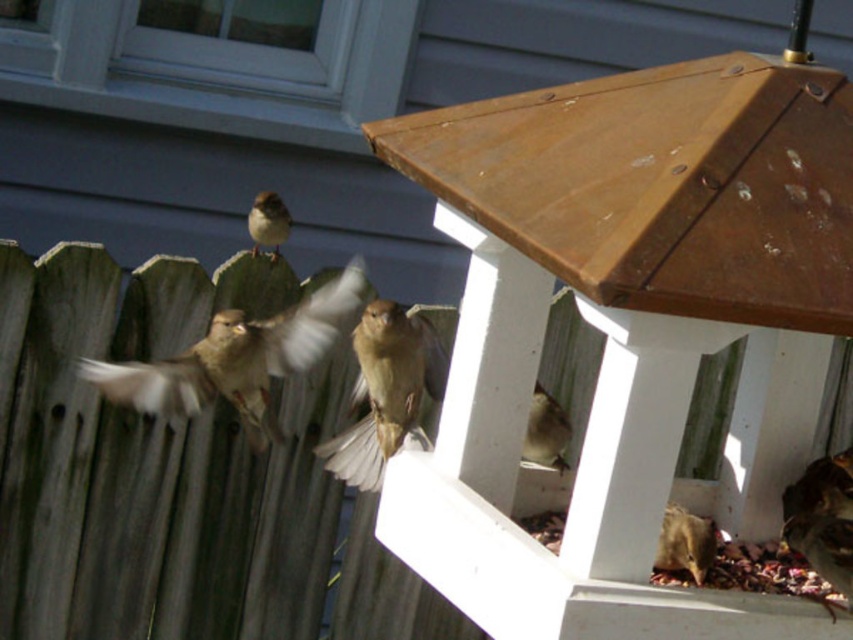
Does weathered wood fence at left appear on the right side of brown matte bird at lower center?

In fact, weathered wood fence at left is to the left of brown matte bird at lower center.

Is point (181, 304) positioned behind point (564, 440)?

Yes, point (181, 304) is farther from viewer.

Identify the location of weathered wood fence at left. This screenshot has width=853, height=640. (152, 464).

Between brown feathered bird at center and brown matte bird at center, which one has more height?

brown feathered bird at center is taller.

Does brown feathered bird at center have a greater height compared to brown matte bird at center?

Yes, brown feathered bird at center is taller than brown matte bird at center.

Where is `brown feathered bird at center`? brown feathered bird at center is located at coordinates (236, 358).

The height and width of the screenshot is (640, 853). What are the coordinates of `brown feathered bird at center` in the screenshot? It's located at (236, 358).

Is weathered wood fence at left below brown feathered bird at upper center?

Indeed, weathered wood fence at left is positioned under brown feathered bird at upper center.

Is weathered wood fence at left above brown feathered bird at upper center?

Actually, weathered wood fence at left is below brown feathered bird at upper center.

Who is more forward, (15,600) or (281,243)?

Positioned in front is point (15,600).

This screenshot has height=640, width=853. Identify the location of weathered wood fence at left. (152, 464).